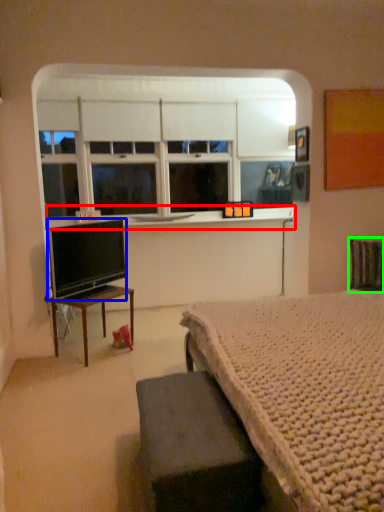
Question: Estimate the real-world distances between objects in this image. Which object is closer to window sill (highlighted by a red box), television (highlighted by a blue box) or swivel chair (highlighted by a green box)?

Choices:
 (A) television
 (B) swivel chair

Answer: (A)